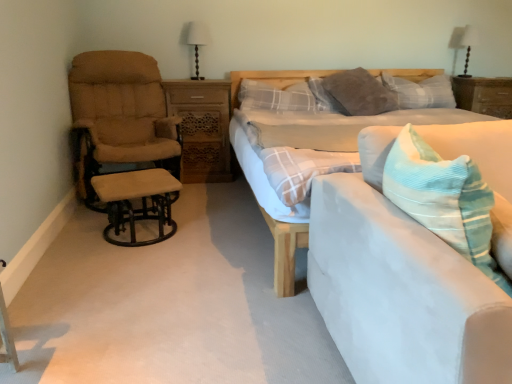
Question: Is light blue fabric bed at center inside the boundaries of white fabric lampshade at upper right, which appears as the first table lamp when viewed from the right, or outside?

Choices:
 (A) outside
 (B) inside

Answer: (A)

Question: Considering the positions of light blue fabric bed at center and white fabric lampshade at upper right, which ranks as the 1th table lamp in back-to-front order, in the image, is light blue fabric bed at center taller or shorter than white fabric lampshade at upper right, which ranks as the 1th table lamp in back-to-front order,?

Choices:
 (A) short
 (B) tall

Answer: (B)

Question: Estimate the real-world distances between objects in this image. Which object is closer to the plaid fabric pillow at center, which is the third pillow from right to left?

Choices:
 (A) wooden nightstand at right, the first nightstand positioned from the right
 (B) beige fabric recliner at left
 (C) white fabric lampshade at upper right, which ranks as the 1th table lamp in back-to-front order
 (D) corduroy blue throw pillow at center
 (E) white fabric-covered table lamp at upper center, the first table lamp viewed from the left

Answer: (E)

Question: Considering the real-world distances, which object is farthest from the wooden carved nightstand at center, marked as the first nightstand in a left-to-right arrangement?

Choices:
 (A) white fabric lampshade at upper right, which appears as the first table lamp when viewed from the right
 (B) wooden nightstand at right, the first nightstand positioned from the right
 (C) white fabric-covered table lamp at upper center, the first table lamp in the front-to-back sequence
 (D) beige fabric stool at left
 (E) plaid fabric pillow at upper center, the 3th pillow when ordered from left to right

Answer: (A)